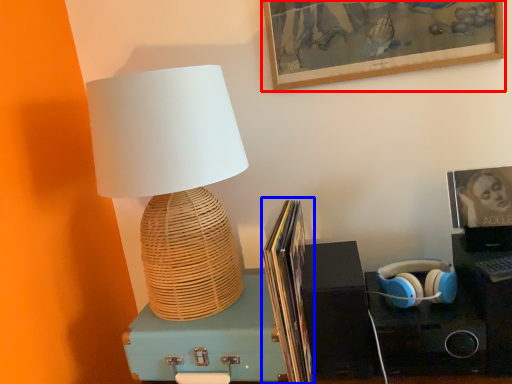
Question: Which object appears closest to the camera in this image, picture frame (highlighted by a red box) or book (highlighted by a blue box)?

Choices:
 (A) picture frame
 (B) book

Answer: (B)